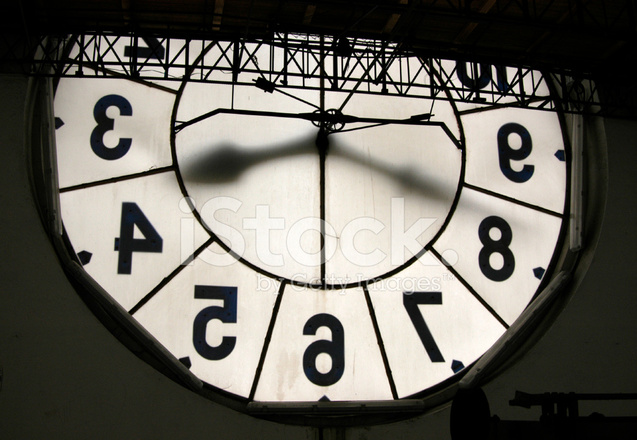
Where is `numbers on clock`? numbers on clock is located at coordinates (508, 147), (488, 244), (415, 309), (332, 354), (227, 310), (154, 241), (108, 152), (155, 45), (503, 73).